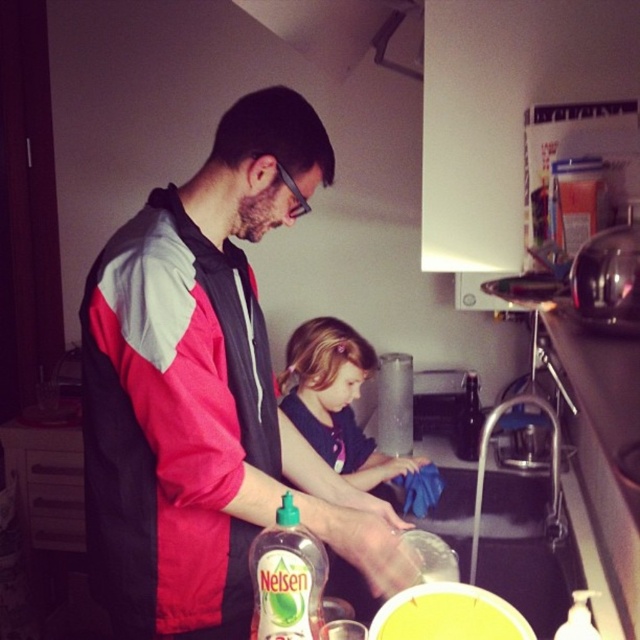
You are a painter who needs to place a 1.2 meter wide canvas between the matte red jacket at center and the brushed metal exhaust hood at upper center. Which object should the canvas be placed closer to, based on their widths?

The matte red jacket at center is wider than the brushed metal exhaust hood at upper center. Therefore, the canvas should be placed closer to the brushed metal exhaust hood at upper center to accommodate its 1.2 meter width.

You are standing in the kitchen and want to reach the dishwashing liquid bottle. The point where you need to reach is at coordinates point [156,589]. If your arm can extend 3 feet, will you be able to reach it?

The distance of point [156,589] from viewer is 3.61 feet. Since your arm can only extend 3 feet, you cannot reach the dishwashing liquid bottle at point [156,589].